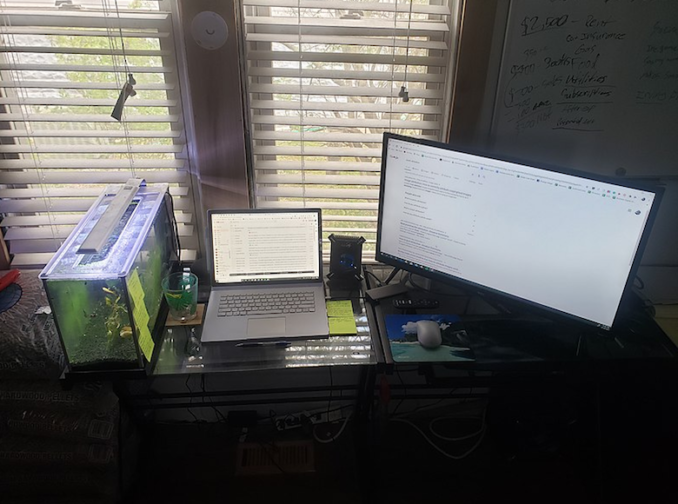
Where is `blind pull cord`? This screenshot has width=678, height=504. blind pull cord is located at coordinates (407, 96), (401, 89), (129, 90), (129, 77).